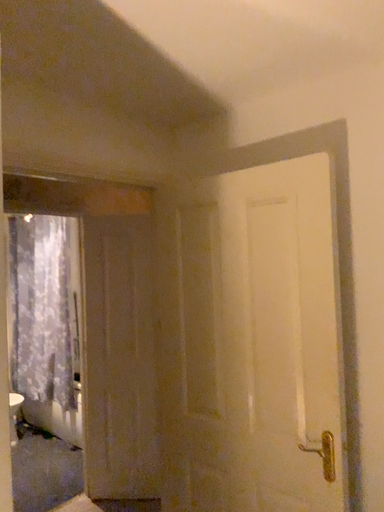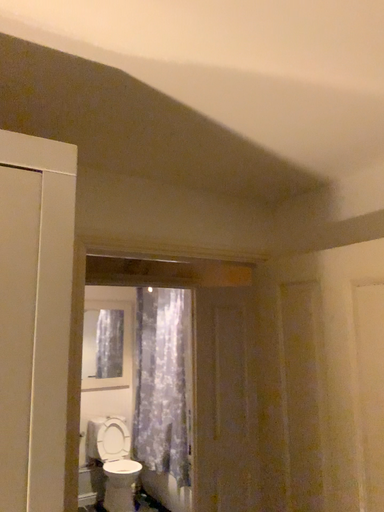
Question: Which way did the camera rotate in the video?

Choices:
 (A) rotated right
 (B) rotated left

Answer: (B)